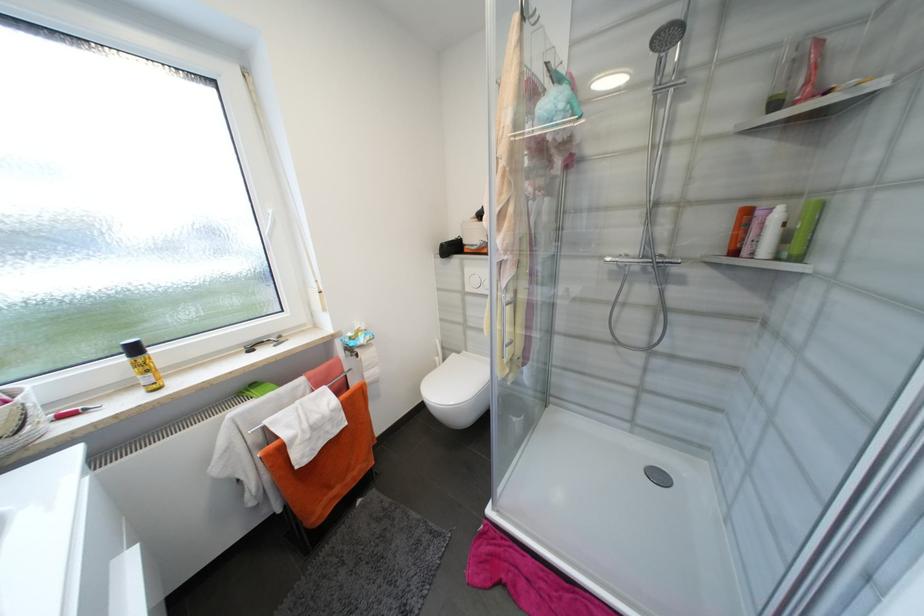
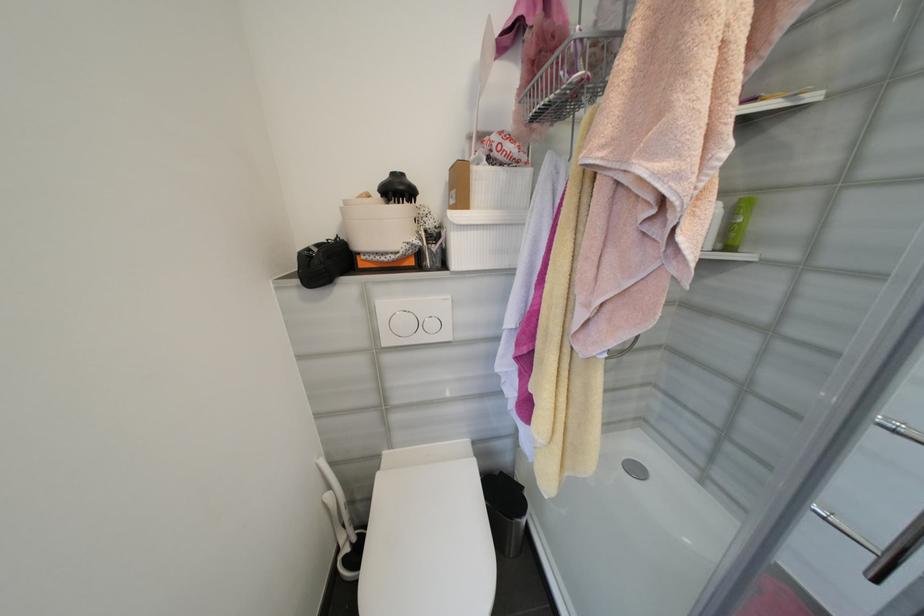
Question: Based on the continuous images, in which direction is the camera rotating? Reply with the corresponding letter.

Choices:
 (A) Left
 (B) Right
 (C) Up
 (D) Down

Answer: (B)